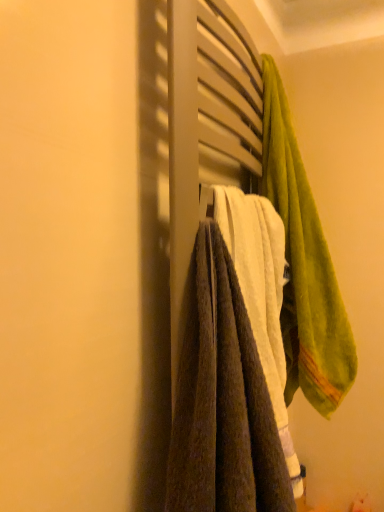
Image resolution: width=384 pixels, height=512 pixels. Identify the location of brown textured towel at center, which is the 2th towel from right to left. (222, 399).

This screenshot has height=512, width=384. What do you see at coordinates (222, 399) in the screenshot?
I see `brown textured towel at center, which is the 2th towel from right to left` at bounding box center [222, 399].

What is the approximate width of brown textured towel at center, the first towel positioned from the left?

It is 7.72 inches.

Image resolution: width=384 pixels, height=512 pixels. Describe the element at coordinates (304, 266) in the screenshot. I see `green soft towel at upper right, the second towel viewed from the left` at that location.

Locate an element on the screen. This screenshot has width=384, height=512. green soft towel at upper right, which is counted as the first towel, starting from the right is located at coordinates (304, 266).

In order to face green soft towel at upper right, which is counted as the first towel, starting from the right, should I rotate leftwards or rightwards?

Rotate your view right by about 15.640°.

Identify the location of brown textured towel at center, the first towel positioned from the left. (222, 399).

Does green soft towel at upper right, which is counted as the first towel, starting from the right, appear on the right side of brown textured towel at center, which is the 2th towel from right to left?

Indeed, green soft towel at upper right, which is counted as the first towel, starting from the right, is positioned on the right side of brown textured towel at center, which is the 2th towel from right to left.

Is green soft towel at upper right, the second towel viewed from the left, closer to camera compared to brown textured towel at center, the first towel positioned from the left?

No, it is not.

Does point (314, 358) come closer to viewer compared to point (192, 490)?

No, it is behind (192, 490).

From the image's perspective, is green soft towel at upper right, which is counted as the first towel, starting from the right, located above brown textured towel at center, which is the 2th towel from right to left?

Yes, from the image's perspective, green soft towel at upper right, which is counted as the first towel, starting from the right, is over brown textured towel at center, which is the 2th towel from right to left.

From a real-world perspective, does green soft towel at upper right, the second towel viewed from the left, sit lower than brown textured towel at center, the first towel positioned from the left?

Actually, green soft towel at upper right, the second towel viewed from the left, is physically above brown textured towel at center, the first towel positioned from the left, in the real world.

Considering the sizes of objects green soft towel at upper right, the second towel viewed from the left, and brown textured towel at center, which is the 2th towel from right to left, in the image provided, who is thinner, green soft towel at upper right, the second towel viewed from the left, or brown textured towel at center, which is the 2th towel from right to left,?

Thinner between the two is brown textured towel at center, which is the 2th towel from right to left.

From the picture: Considering the relative sizes of green soft towel at upper right, the second towel viewed from the left, and brown textured towel at center, the first towel positioned from the left, in the image provided, is green soft towel at upper right, the second towel viewed from the left, taller than brown textured towel at center, the first towel positioned from the left,?

Yes, green soft towel at upper right, the second towel viewed from the left, is taller than brown textured towel at center, the first towel positioned from the left.

Based on their sizes in the image, would you say green soft towel at upper right, the second towel viewed from the left, is bigger or smaller than brown textured towel at center, which is the 2th towel from right to left?

Clearly, green soft towel at upper right, the second towel viewed from the left, is larger in size than brown textured towel at center, which is the 2th towel from right to left.

Is green soft towel at upper right, the second towel viewed from the left, completely or partially outside of brown textured towel at center, the first towel positioned from the left?

Yes, green soft towel at upper right, the second towel viewed from the left, is not within brown textured towel at center, the first towel positioned from the left.

Is green soft towel at upper right, the second towel viewed from the left, in contact with brown textured towel at center, the first towel positioned from the left?

No, green soft towel at upper right, the second towel viewed from the left, is not in contact with brown textured towel at center, the first towel positioned from the left.

Is green soft towel at upper right, which is counted as the first towel, starting from the right, positioned with its back to brown textured towel at center, the first towel positioned from the left?

No, brown textured towel at center, the first towel positioned from the left, is not at the back of green soft towel at upper right, which is counted as the first towel, starting from the right.

How many degrees apart are the facing directions of green soft towel at upper right, the second towel viewed from the left, and brown textured towel at center, which is the 2th towel from right to left?

They differ by 0.000202 degrees in their facing directions.

How much distance is there between green soft towel at upper right, the second towel viewed from the left, and brown textured towel at center, which is the 2th towel from right to left?

15.16 inches.

Find the location of a particular element. towel above the brown textured towel at center, the first towel positioned from the left (from a real-world perspective) is located at coordinates (304, 266).

Is brown textured towel at center, which is the 2th towel from right to left, at the left side of green soft towel at upper right, the second towel viewed from the left?

Correct, you'll find brown textured towel at center, which is the 2th towel from right to left, to the left of green soft towel at upper right, the second towel viewed from the left.

Who is more distant, brown textured towel at center, which is the 2th towel from right to left, or green soft towel at upper right, the second towel viewed from the left?

green soft towel at upper right, the second towel viewed from the left.

Does point (245, 365) come closer to viewer compared to point (313, 240)?

Yes, it is in front of point (313, 240).

From the image's perspective, would you say brown textured towel at center, which is the 2th towel from right to left, is positioned over green soft towel at upper right, the second towel viewed from the left?

Incorrect, from the image's perspective, brown textured towel at center, which is the 2th towel from right to left, is lower than green soft towel at upper right, the second towel viewed from the left.

From a real-world perspective, is brown textured towel at center, which is the 2th towel from right to left, located higher than green soft towel at upper right, which is counted as the first towel, starting from the right?

No.

From the picture: Considering the relative sizes of brown textured towel at center, the first towel positioned from the left, and green soft towel at upper right, which is counted as the first towel, starting from the right, in the image provided, is brown textured towel at center, the first towel positioned from the left, thinner than green soft towel at upper right, which is counted as the first towel, starting from the right,?

Yes.

Considering the sizes of brown textured towel at center, the first towel positioned from the left, and green soft towel at upper right, the second towel viewed from the left, in the image, is brown textured towel at center, the first towel positioned from the left, taller or shorter than green soft towel at upper right, the second towel viewed from the left,?

brown textured towel at center, the first towel positioned from the left, is shorter than green soft towel at upper right, the second towel viewed from the left.

Looking at the image, does brown textured towel at center, the first towel positioned from the left, seem bigger or smaller compared to green soft towel at upper right, the second towel viewed from the left?

brown textured towel at center, the first towel positioned from the left, is smaller than green soft towel at upper right, the second towel viewed from the left.

Is brown textured towel at center, which is the 2th towel from right to left, situated inside green soft towel at upper right, the second towel viewed from the left, or outside?

brown textured towel at center, which is the 2th towel from right to left, is outside green soft towel at upper right, the second towel viewed from the left.

Is brown textured towel at center, which is the 2th towel from right to left, not close to green soft towel at upper right, which is counted as the first towel, starting from the right?

No, there isn't a large distance between brown textured towel at center, which is the 2th towel from right to left, and green soft towel at upper right, which is counted as the first towel, starting from the right.

Does brown textured towel at center, which is the 2th towel from right to left, turn towards green soft towel at upper right, the second towel viewed from the left?

No, brown textured towel at center, which is the 2th towel from right to left, is not oriented towards green soft towel at upper right, the second towel viewed from the left.

What's the angular difference between brown textured towel at center, the first towel positioned from the left, and green soft towel at upper right, the second towel viewed from the left,'s facing directions?

They differ by 0.000202 degrees in their facing directions.

Locate an element on the screen. The height and width of the screenshot is (512, 384). towel directly beneath the green soft towel at upper right, the second towel viewed from the left (from a real-world perspective) is located at coordinates (222, 399).

This screenshot has height=512, width=384. Find the location of `towel located behind the brown textured towel at center, the first towel positioned from the left`. towel located behind the brown textured towel at center, the first towel positioned from the left is located at coordinates (304, 266).

Find the location of a particular element. towel below the green soft towel at upper right, which is counted as the first towel, starting from the right (from a real-world perspective) is located at coordinates (222, 399).